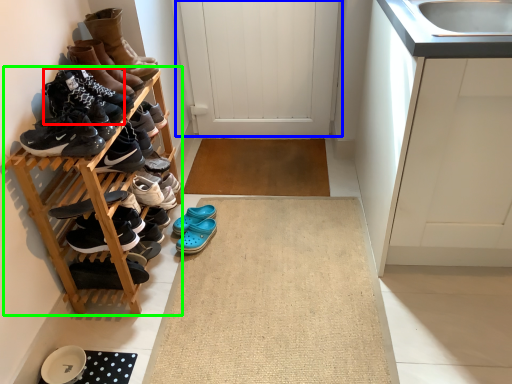
Question: Estimate the real-world distances between objects in this image. Which object is closer to footwear (highlighted by a red box), door (highlighted by a blue box) or shelf (highlighted by a green box)?

Choices:
 (A) door
 (B) shelf

Answer: (B)